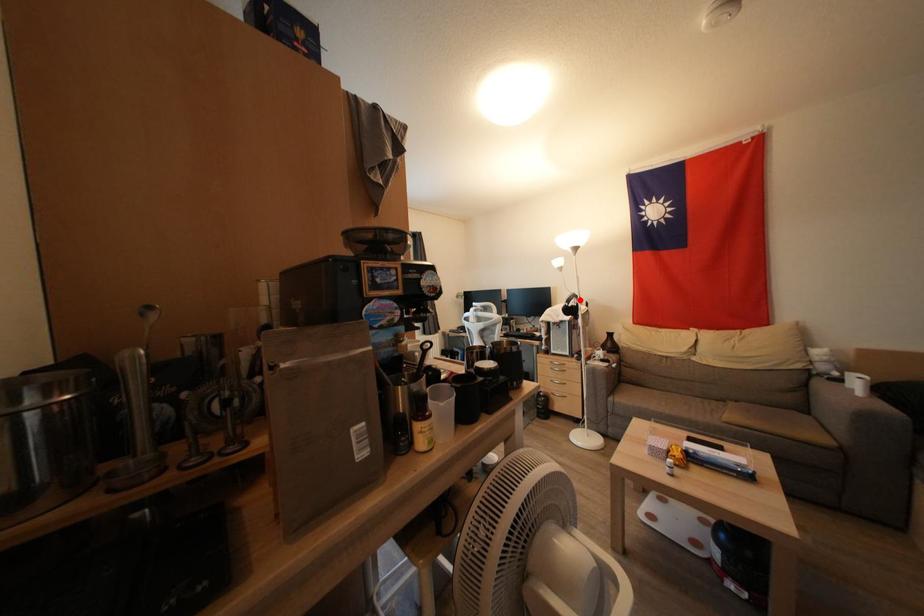
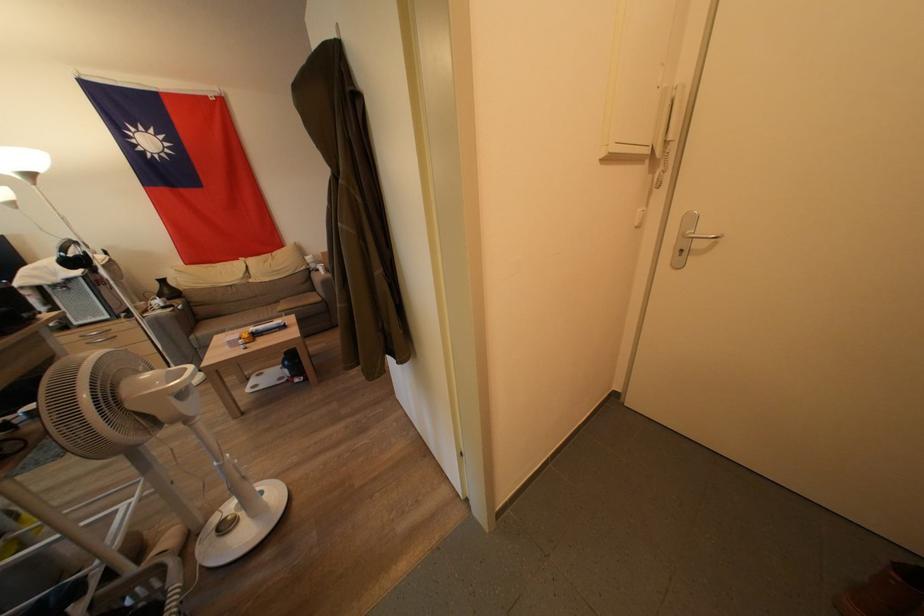
Find the pixel in the second image that matches the highlighted location in the first image.

(79, 246)